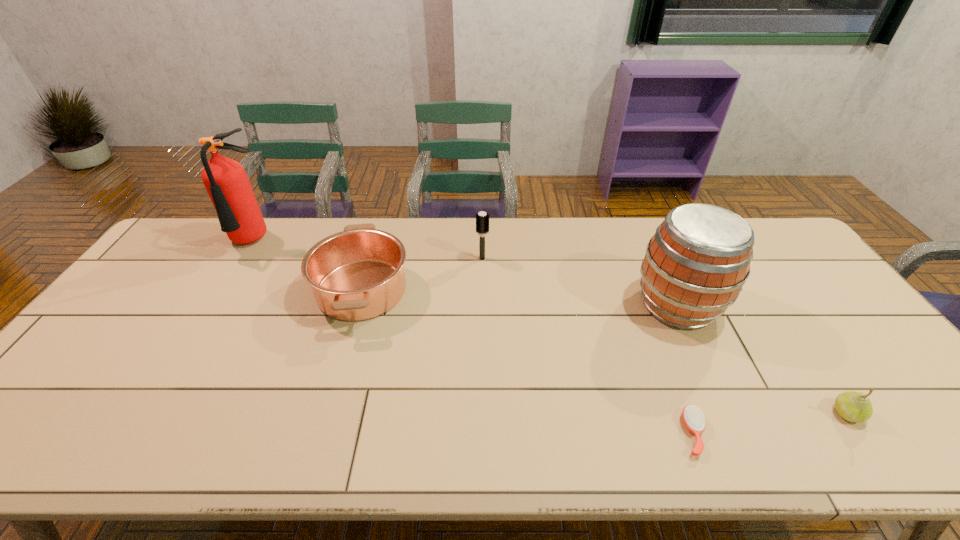
Locate an element on the screen. The height and width of the screenshot is (540, 960). object at the right edge is located at coordinates (853, 406).

The image size is (960, 540). I want to click on object that is at the near right corner, so (x=853, y=406).

The width and height of the screenshot is (960, 540). What are the coordinates of `free point at the far edge` in the screenshot? It's located at (632, 234).

In the image, there is a desktop. Find the location of `vacant space at the near edge`. vacant space at the near edge is located at coordinates click(791, 446).

Where is `free location at the left edge of the desktop`? free location at the left edge of the desktop is located at coordinates click(x=123, y=355).

In the image, there is a desktop. Where is `vacant space at the right edge`? vacant space at the right edge is located at coordinates (884, 407).

The height and width of the screenshot is (540, 960). I want to click on free space between the cider and the rightmost object, so click(x=762, y=359).

This screenshot has height=540, width=960. I want to click on vacant area that lies between the cider and the saucepan, so click(x=519, y=297).

Locate an element on the screen. vacant space that's between the pear and the second object from left to right is located at coordinates (605, 352).

This screenshot has width=960, height=540. I want to click on unoccupied area between the pear and the third tallest object, so click(x=664, y=336).